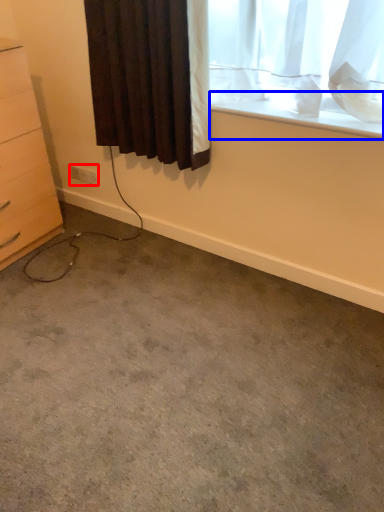
Question: Among these objects, which one is nearest to the camera, electric outlet (highlighted by a red box) or window sill (highlighted by a blue box)?

Choices:
 (A) electric outlet
 (B) window sill

Answer: (B)